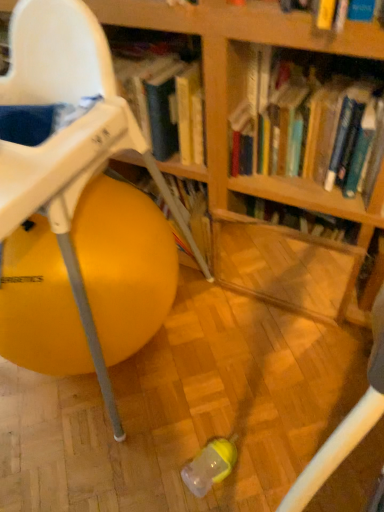
Question: Does hardcover book at upper center have a larger size compared to yellow rubber ball at left?

Choices:
 (A) yes
 (B) no

Answer: (B)

Question: Is hardcover book at upper center looking in the opposite direction of yellow rubber ball at left?

Choices:
 (A) no
 (B) yes

Answer: (A)

Question: Does hardcover book at upper center have a greater width compared to yellow rubber ball at left?

Choices:
 (A) yes
 (B) no

Answer: (B)

Question: Is hardcover book at upper center positioned in front of yellow rubber ball at left?

Choices:
 (A) no
 (B) yes

Answer: (A)

Question: From a real-world perspective, is hardcover book at upper center physically above yellow rubber ball at left?

Choices:
 (A) yes
 (B) no

Answer: (A)

Question: Could you tell me if hardcover book at upper center is facing yellow rubber ball at left?

Choices:
 (A) no
 (B) yes

Answer: (A)

Question: Is yellow rubber ball at left behind hardcover book at upper center?

Choices:
 (A) no
 (B) yes

Answer: (A)

Question: Does yellow rubber ball at left have a lesser width compared to hardcover book at upper center?

Choices:
 (A) yes
 (B) no

Answer: (B)

Question: Does yellow rubber ball at left have a greater height compared to hardcover book at upper center?

Choices:
 (A) yes
 (B) no

Answer: (A)

Question: From the image's perspective, is yellow rubber ball at left above hardcover book at upper center?

Choices:
 (A) yes
 (B) no

Answer: (B)

Question: From a real-world perspective, is yellow rubber ball at left under hardcover book at upper center?

Choices:
 (A) yes
 (B) no

Answer: (A)

Question: Is yellow rubber ball at left outside of hardcover book at upper center?

Choices:
 (A) yes
 (B) no

Answer: (A)

Question: From the image's perspective, is yellow rubber ball at left above or below hardcover book at upper center?

Choices:
 (A) above
 (B) below

Answer: (B)